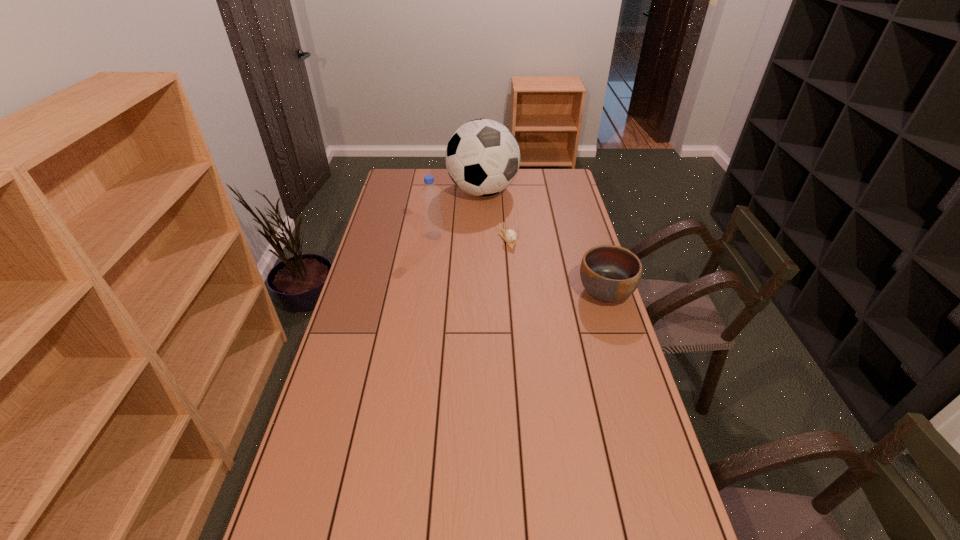
Identify the location of free spot on the desktop that is between the bottle and the third tallest object and is positioned on the main logo of the farthest object. The height and width of the screenshot is (540, 960). (536, 269).

At what (x,y) coordinates should I click in order to perform the action: click on free space on the desktop that is between the third shortest object and the bowl and is positioned on the shell of the escargot. Please return your answer as a coordinate pair (x, y). This screenshot has width=960, height=540. Looking at the image, I should click on (531, 267).